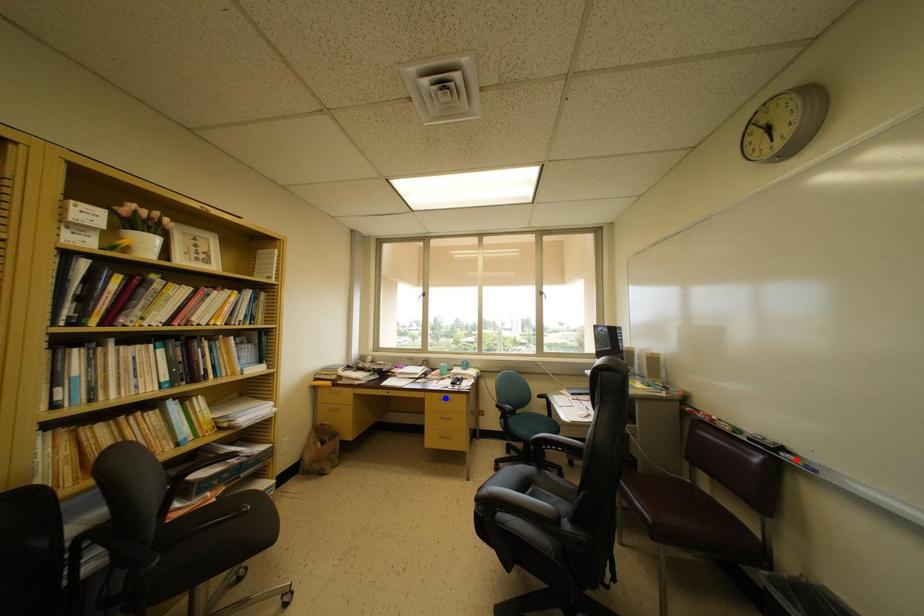
Question: In the image, two points are highlighted. Which point is nearer to the camera? Reply with the corresponding letter.

Choices:
 (A) blue point
 (B) red point

Answer: (B)